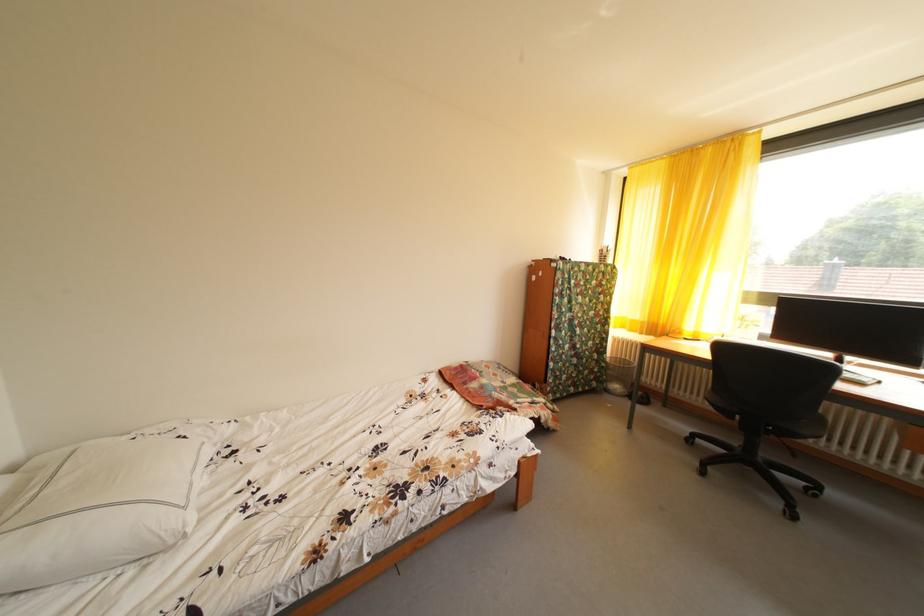
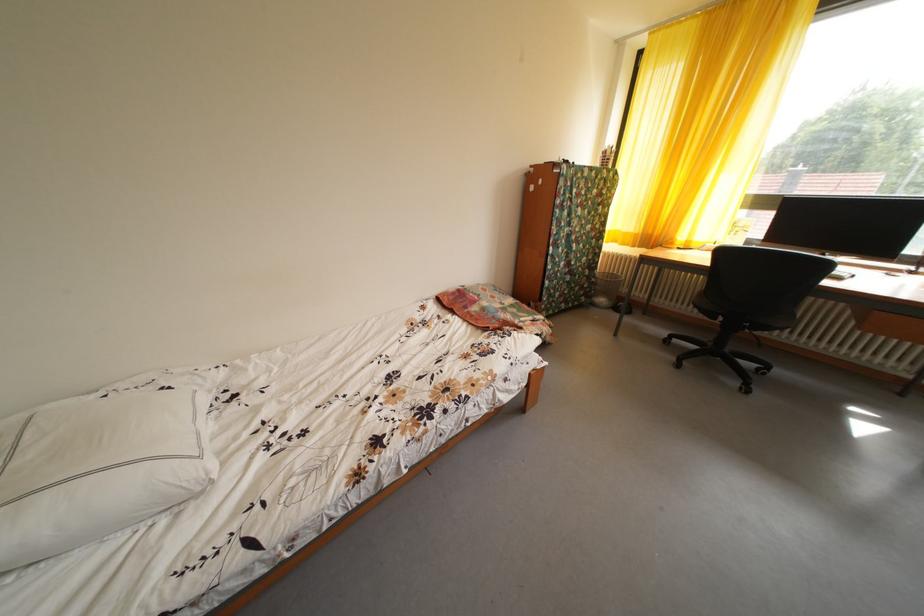
Question: Based on the continuous images, in which direction is the camera rotating? Reply with the corresponding letter.

Choices:
 (A) Left
 (B) Right
 (C) Up
 (D) Down

Answer: (D)